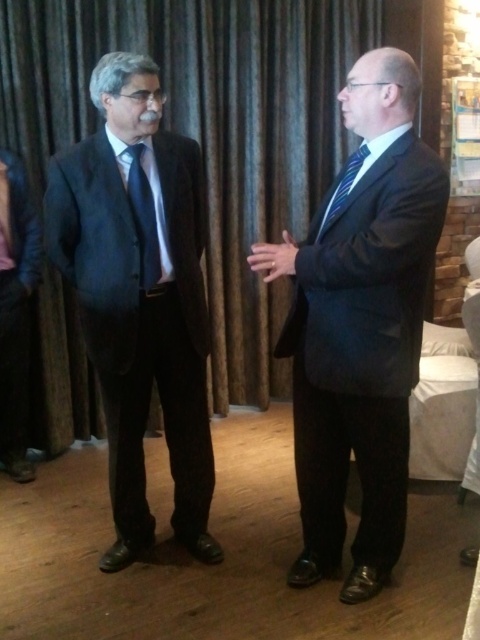
Question: Which of these objects is positioned farthest from the matte black suit at left?

Choices:
 (A) brown textured curtain at upper center
 (B) matte black suit at center

Answer: (B)

Question: Does matte black suit at center have a lesser width compared to blue striped tie at right?

Choices:
 (A) yes
 (B) no

Answer: (B)

Question: Does matte black tie at center appear on the right side of blue striped tie at right?

Choices:
 (A) yes
 (B) no

Answer: (B)

Question: Which point appears farthest from the camera in this image?

Choices:
 (A) (158, 268)
 (B) (357, 148)
 (C) (330, 56)
 (D) (104, 570)

Answer: (C)

Question: Is dark blue suit at left positioned before matte black suit at left?

Choices:
 (A) yes
 (B) no

Answer: (A)

Question: Estimate the real-world distances between objects in this image. Which object is farther from the matte black tie at center?

Choices:
 (A) brown textured curtain at upper center
 (B) blue striped tie at right
 (C) dark blue suit at left
 (D) matte black suit at center

Answer: (A)